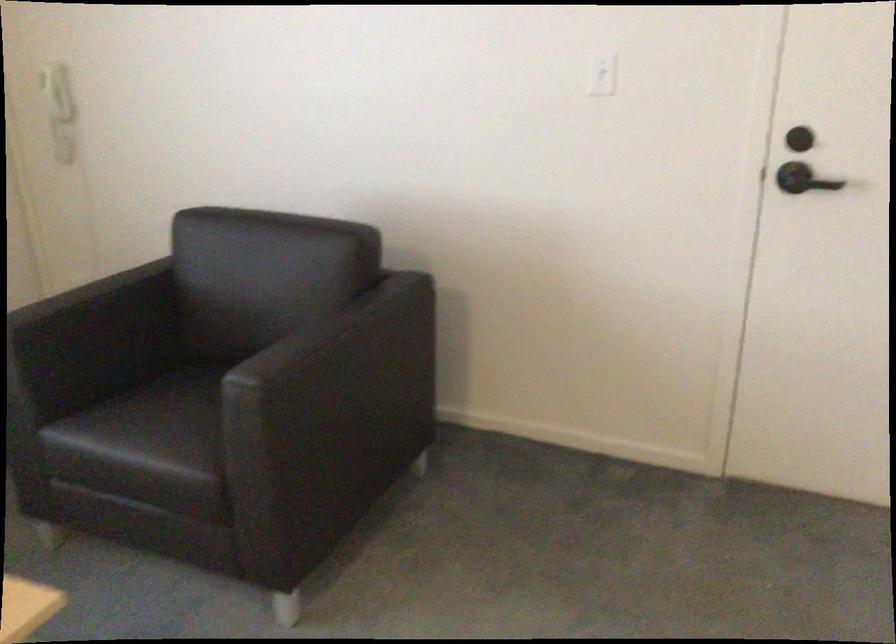
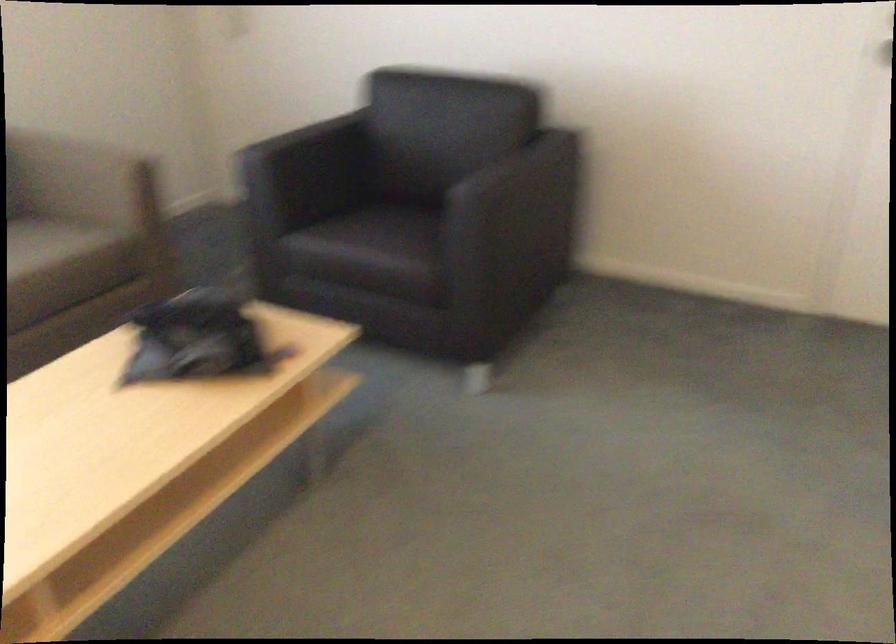
In a continuous first-person perspective shot, in which direction is the camera moving?

The movement direction of the cameraman is left, backward.